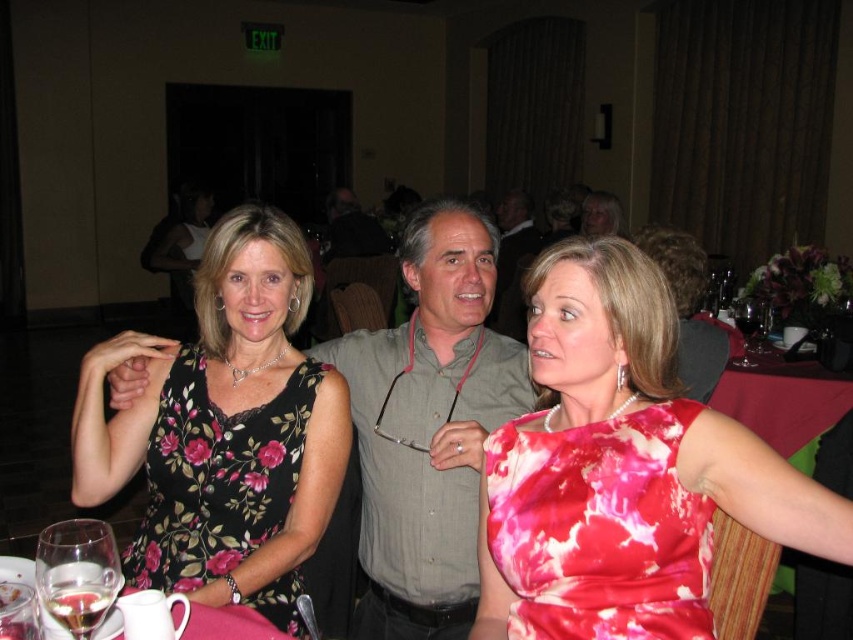
Question: Which of the following is the farthest from the observer?

Choices:
 (A) pink fabric table at lower left
 (B) matte pink dress at center

Answer: (B)

Question: Is shiny pink dress at center to the right of transparent glass wine at right from the viewer's perspective?

Choices:
 (A) yes
 (B) no

Answer: (B)

Question: Does floral-patterned fabric dress at center come in front of transparent glass wine at right?

Choices:
 (A) yes
 (B) no

Answer: (A)

Question: Is pink fabric table at lower left smaller than transparent glass wine at right?

Choices:
 (A) yes
 (B) no

Answer: (A)

Question: Based on their relative distances, which object is farther from the floral-patterned fabric dress at center?

Choices:
 (A) matte pink dress at center
 (B) gray striped shirt at center
 (C) pink fabric table at lower left
 (D) shiny pink dress at center

Answer: (D)

Question: Which point is closer to the camera?

Choices:
 (A) (221, 513)
 (B) (805, 515)

Answer: (B)